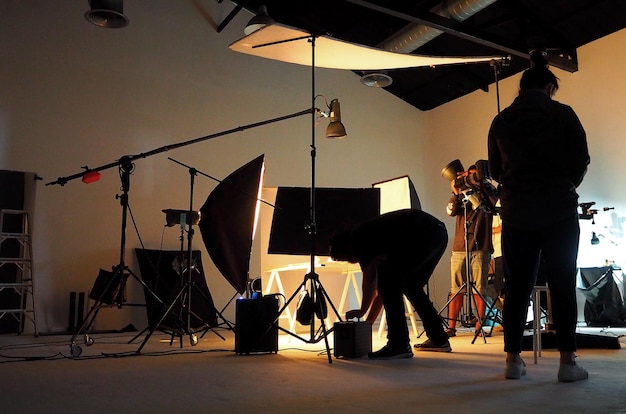
Identify the location of ceiling vents. The image size is (626, 414). (379, 84), (108, 16).